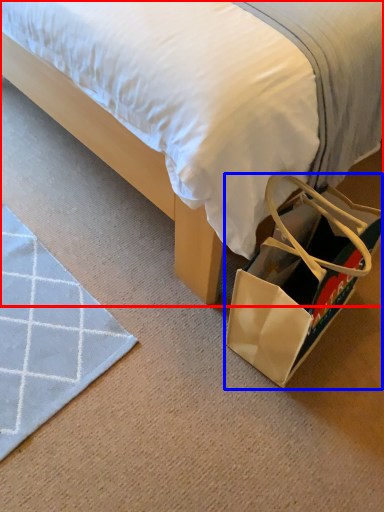
Question: Which object is closer to the camera taking this photo, bed (highlighted by a red box) or shoulder bag (highlighted by a blue box)?

Choices:
 (A) bed
 (B) shoulder bag

Answer: (A)